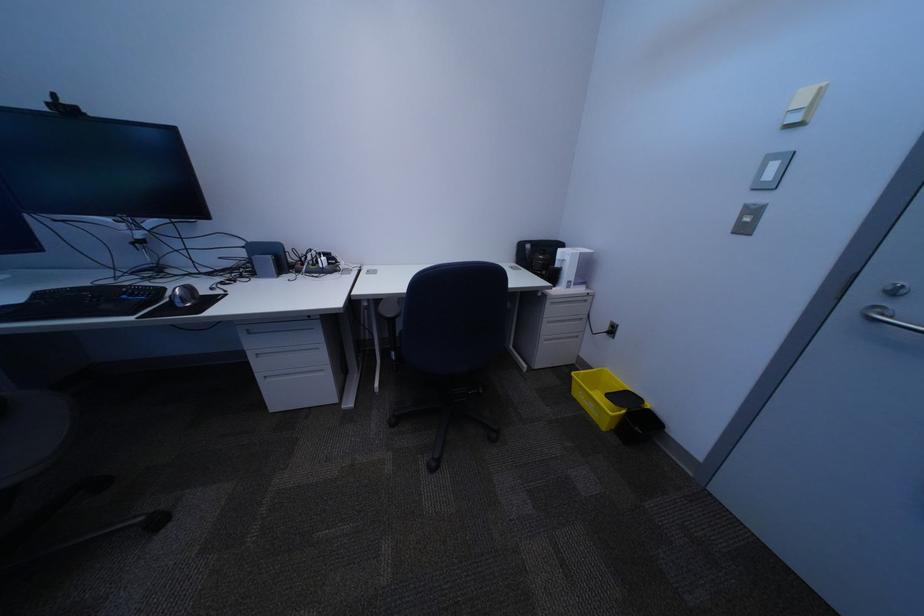
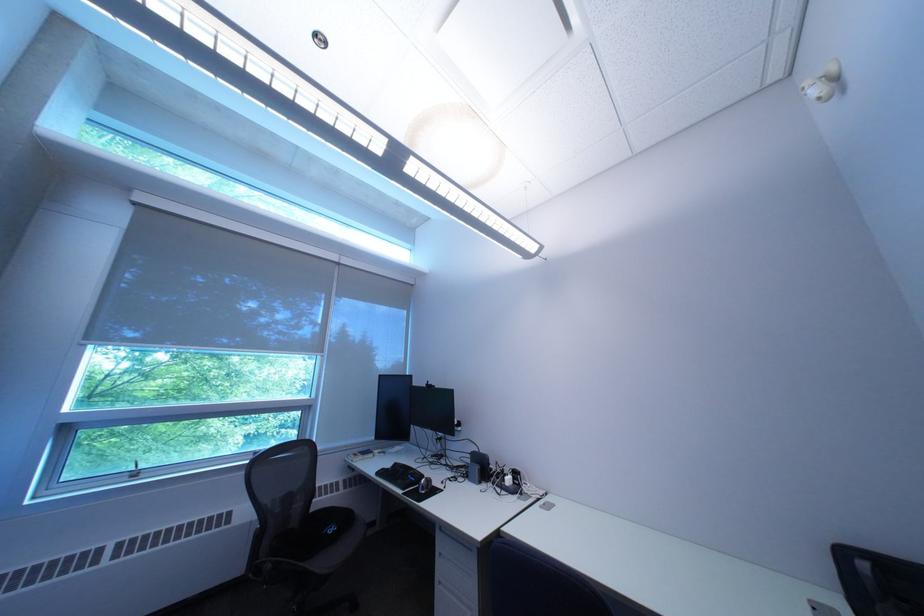
The point at [372,273] is marked in the first image. Where is the corresponding point in the second image?

(551, 501)